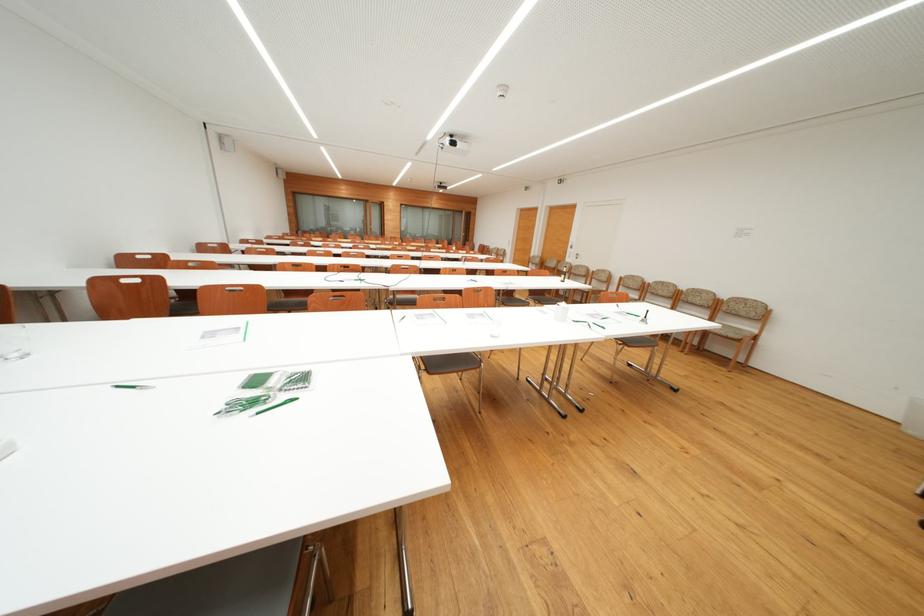
The height and width of the screenshot is (616, 924). What do you see at coordinates (733, 331) in the screenshot?
I see `a chair sitting surface` at bounding box center [733, 331].